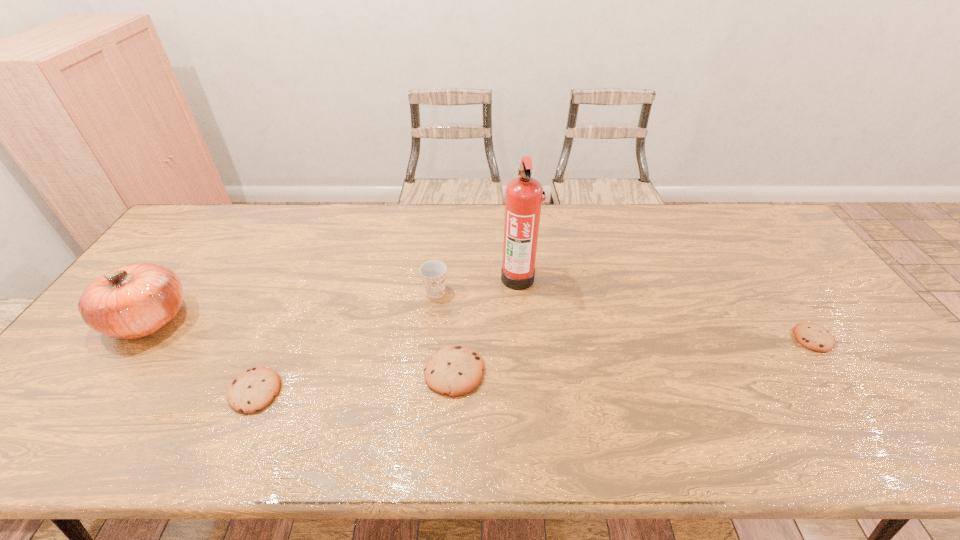
Where is `object that is at the right edge`? object that is at the right edge is located at coordinates (812, 336).

In order to click on free space at the far edge of the desktop in this screenshot , I will do `click(362, 232)`.

This screenshot has width=960, height=540. I want to click on vacant region at the near edge, so (x=761, y=379).

In order to click on vacant region at the left edge in this screenshot , I will do `click(144, 338)`.

Where is `vacant space at the right edge`? vacant space at the right edge is located at coordinates (798, 287).

Find the location of a particular element. This screenshot has width=960, height=540. vacant space at the far right corner is located at coordinates (735, 206).

Where is `vacant space that's between the Dixie cup and the leftmost object`? This screenshot has width=960, height=540. vacant space that's between the Dixie cup and the leftmost object is located at coordinates (292, 306).

Locate an element on the screen. free space that is in between the second shortest cookie and the Dixie cup is located at coordinates (346, 342).

Locate an element on the screen. empty space between the second cookie from right to left and the leftmost object is located at coordinates (301, 346).

The width and height of the screenshot is (960, 540). Identify the location of empty space between the rightmost object and the second cookie from left to right. (634, 355).